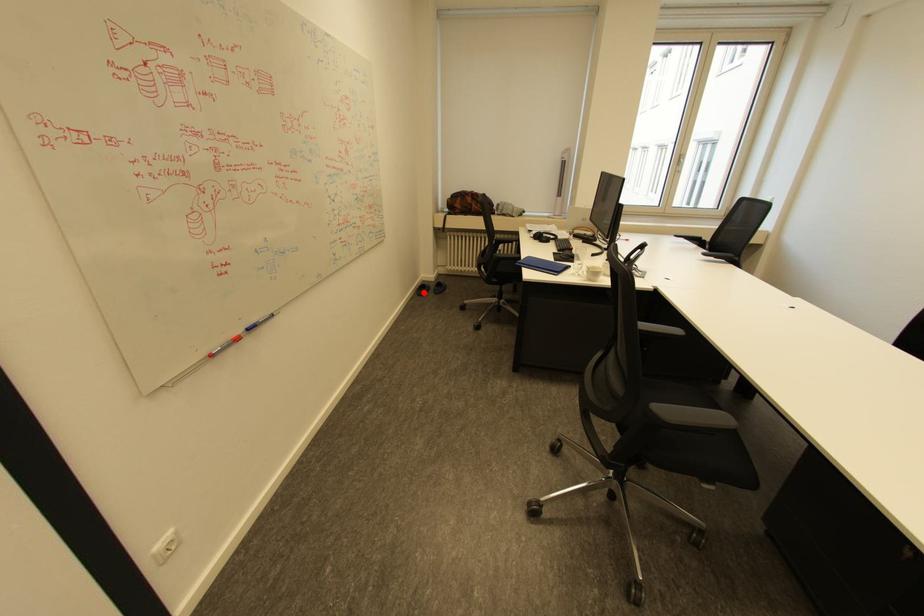
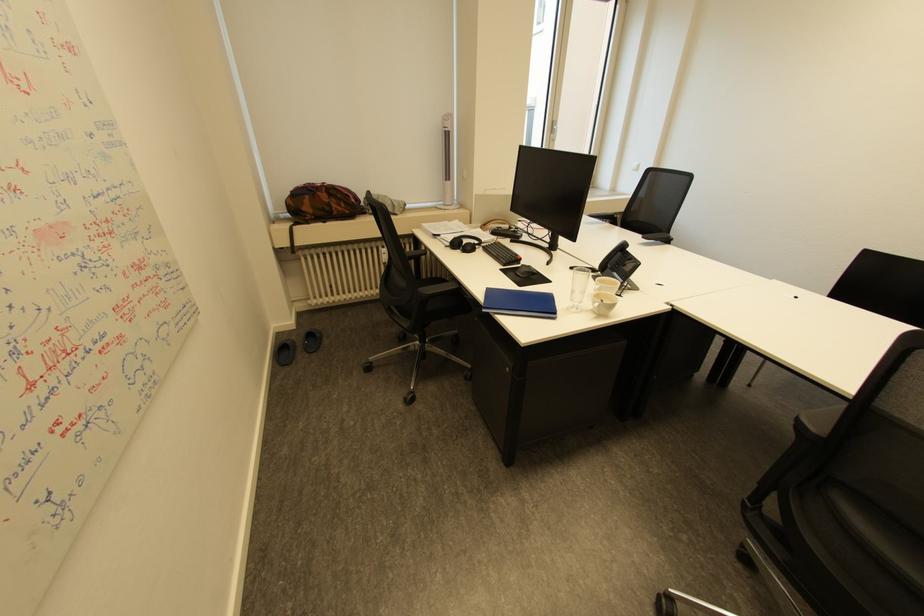
Question: I am providing you with two images of the same scene from different viewpoints. Given a red point in image1, look at the same physical point in image2. Is it:

Choices:
 (A) Closer to the viewpoint
 (B) Farther from the viewpoint

Answer: (B)